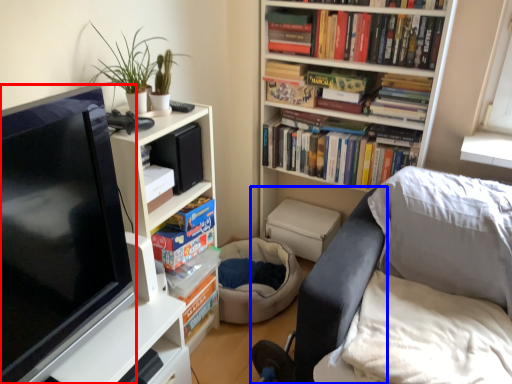
Question: Which object appears farthest to the camera in this image, television (highlighted by a red box) or swivel chair (highlighted by a blue box)?

Choices:
 (A) television
 (B) swivel chair

Answer: (B)